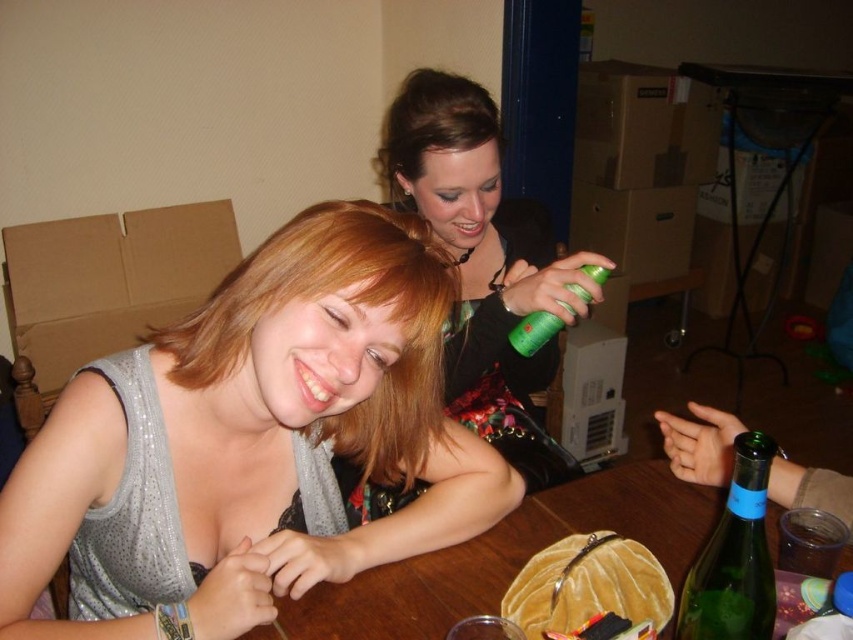
You are a delivery person who needs to place a new item between the green glass bottle at lower right and the green matte spray can at upper center. The item is 15 inches long. Can you fit it between them?

The distance between the green glass bottle at lower right and the green matte spray can at upper center is 16.57 inches. Since the item is 15 inches long, it can fit between them as there is enough space.

You are a delivery person who needs to place a small package between the velvet brown purse at center and the green glass bottle at lower right on the table. Can you fit the package there?

The distance between the velvet brown purse at center and the green glass bottle at lower right is 7.31 inches, so the package can be placed there if it is smaller than or equal to that distance.